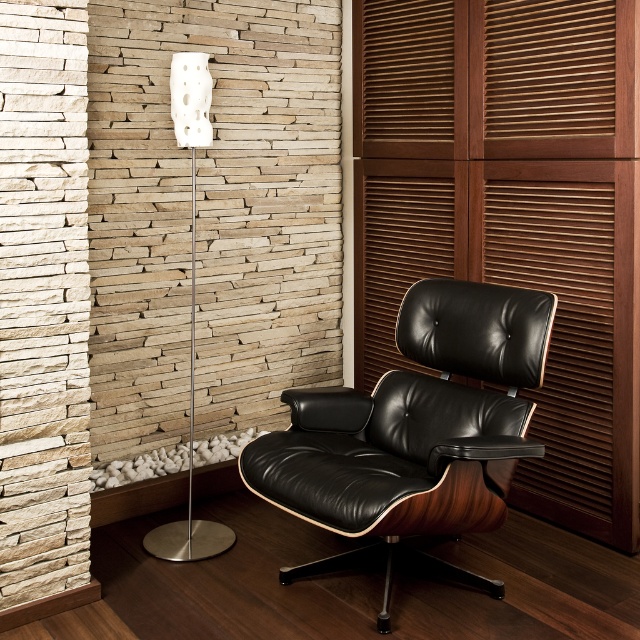
Question: Which object is positioned farthest from the white matte floor lamp at left?

Choices:
 (A) wooden slats at right
 (B) black leather swivel chair at center

Answer: (A)

Question: Which point is closer to the camera?

Choices:
 (A) (392, 563)
 (B) (605, 141)
 (C) (195, 554)

Answer: (A)

Question: Estimate the real-world distances between objects in this image. Which object is farther from the black leather swivel chair at center?

Choices:
 (A) white matte floor lamp at left
 (B) wooden slats at right

Answer: (A)

Question: Can you confirm if wooden slats at right is positioned below white matte floor lamp at left?

Choices:
 (A) no
 (B) yes

Answer: (A)

Question: Can you confirm if wooden slats at right is smaller than black leather swivel chair at center?

Choices:
 (A) yes
 (B) no

Answer: (B)

Question: Is wooden slats at right positioned behind white matte floor lamp at left?

Choices:
 (A) no
 (B) yes

Answer: (A)